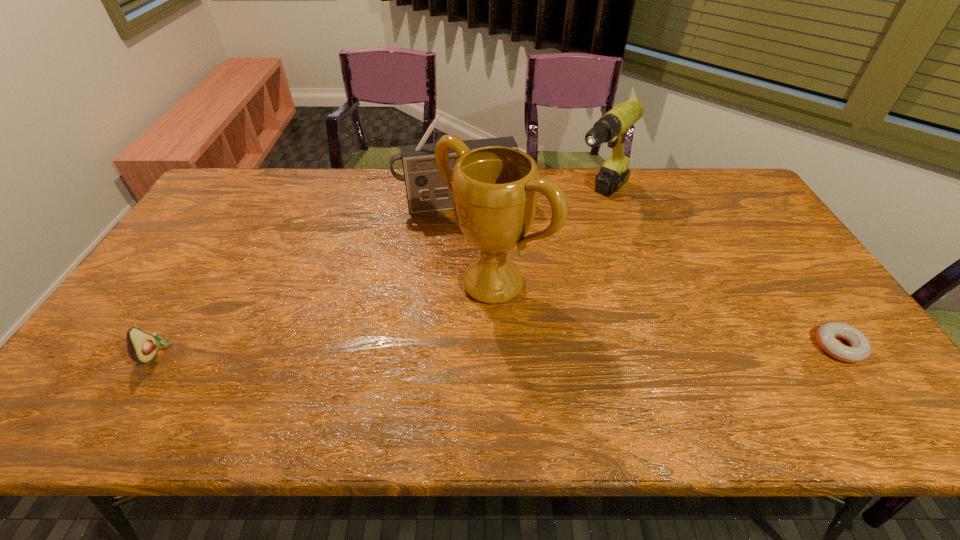
Find the location of `drill located at the far edge`. drill located at the far edge is located at coordinates (x=612, y=127).

Where is `avocado that is at the near edge`? avocado that is at the near edge is located at coordinates (141, 346).

The width and height of the screenshot is (960, 540). Identify the location of doughnut that is at the near edge. (860, 350).

The width and height of the screenshot is (960, 540). Identify the location of object located at the left edge. (141, 346).

Identify the location of object that is at the right edge. (860, 350).

What are the coordinates of `object located at the near left corner` in the screenshot? It's located at click(x=141, y=346).

Where is `object present at the near right corner`? object present at the near right corner is located at coordinates (860, 350).

The image size is (960, 540). Identify the location of free space at the far edge of the desktop. (291, 187).

In the image, there is a desktop. At what (x,y) coordinates should I click in order to perform the action: click on vacant region at the near edge. Please return your answer as a coordinate pair (x, y). Looking at the image, I should click on (657, 359).

Locate an element on the screen. This screenshot has height=540, width=960. vacant position at the far left corner of the desktop is located at coordinates [x=215, y=195].